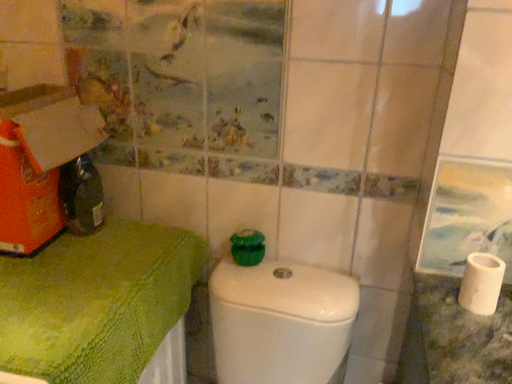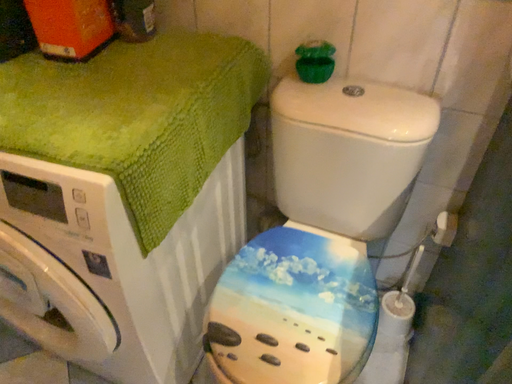
Question: How did the camera likely rotate when shooting the video?

Choices:
 (A) rotated right
 (B) rotated left

Answer: (B)